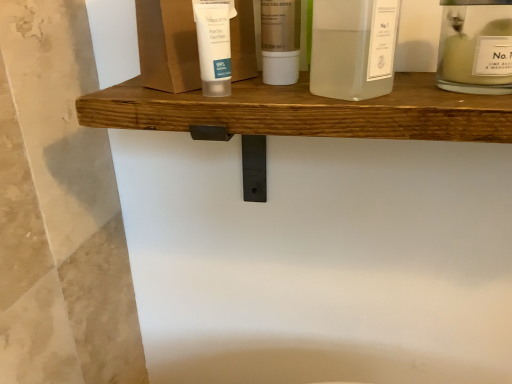
Question: Is clear glass jar at upper right, the first toiletry when ordered from right to left, further to the viewer compared to white matte tube at center, placed as the third toiletry when sorted from right to left?

Choices:
 (A) no
 (B) yes

Answer: (A)

Question: Can you see clear glass jar at upper right, the third toiletry from the left, touching white matte tube at center, the first toiletry positioned from the left?

Choices:
 (A) no
 (B) yes

Answer: (A)

Question: Would you say clear glass jar at upper right, the third toiletry from the left, contains white matte tube at center, placed as the third toiletry when sorted from right to left?

Choices:
 (A) no
 (B) yes

Answer: (A)

Question: Would you say clear glass jar at upper right, the third toiletry from the left, is outside white matte tube at center, placed as the third toiletry when sorted from right to left?

Choices:
 (A) no
 (B) yes

Answer: (B)

Question: From a real-world perspective, does clear glass jar at upper right, the third toiletry from the left, stand above white matte tube at center, placed as the third toiletry when sorted from right to left?

Choices:
 (A) yes
 (B) no

Answer: (B)

Question: Is clear glass jar at upper right, the third toiletry from the left, shorter than white matte tube at center, the first toiletry positioned from the left?

Choices:
 (A) yes
 (B) no

Answer: (B)

Question: Is translucent plastic tube at upper center, the 2th product positioned from the right, inside translucent plastic bottle at center, arranged as the 2th toiletry when viewed from the right?

Choices:
 (A) yes
 (B) no

Answer: (B)

Question: From a real-world perspective, is translucent plastic bottle at center, arranged as the 2th toiletry when viewed from the right, positioned under translucent plastic tube at upper center, the 2th product positioned from the right, based on gravity?

Choices:
 (A) no
 (B) yes

Answer: (B)

Question: Does translucent plastic bottle at center, positioned as the 2th toiletry in left-to-right order, have a lesser height compared to translucent plastic tube at upper center, acting as the 1th product starting from the left?

Choices:
 (A) no
 (B) yes

Answer: (B)

Question: Is translucent plastic bottle at center, positioned as the 2th toiletry in left-to-right order, at the left side of translucent plastic tube at upper center, acting as the 1th product starting from the left?

Choices:
 (A) yes
 (B) no

Answer: (B)

Question: From a real-world perspective, is translucent plastic bottle at center, positioned as the 2th toiletry in left-to-right order, located higher than translucent plastic tube at upper center, acting as the 1th product starting from the left?

Choices:
 (A) yes
 (B) no

Answer: (B)

Question: Is translucent plastic bottle at center, arranged as the 2th toiletry when viewed from the right, next to translucent plastic tube at upper center, acting as the 1th product starting from the left, and touching it?

Choices:
 (A) yes
 (B) no

Answer: (A)

Question: Is there a large distance between translucent plastic tube at upper center, acting as the 1th product starting from the left, and translucent glass bottle at center, which is the second product from left to right?

Choices:
 (A) no
 (B) yes

Answer: (A)